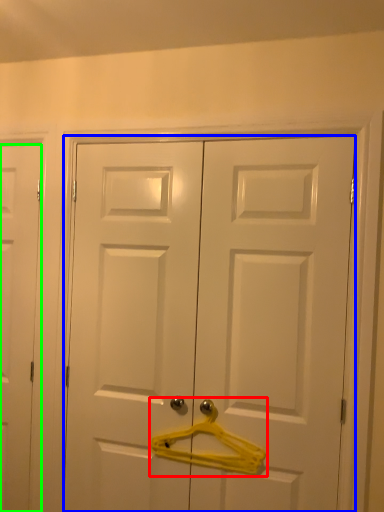
Question: Considering the real-world distances, which object is closest to hanger (highlighted by a red box)? door (highlighted by a blue box) or door (highlighted by a green box).

Choices:
 (A) door
 (B) door

Answer: (A)